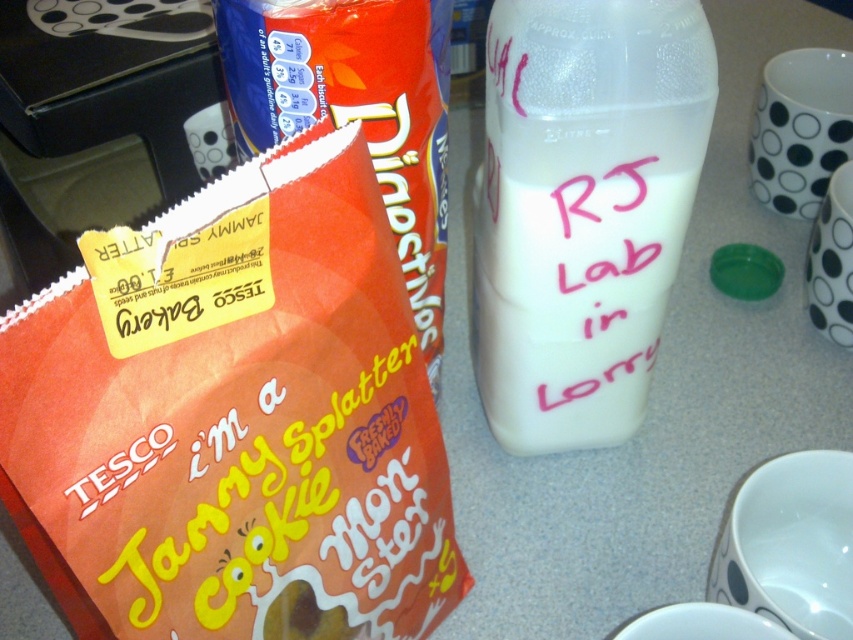
Who is shorter, orange paper bag at left or white marker text at center?

white marker text at center

Looking at this image, can you confirm if orange paper bag at left is positioned below white marker text at center?

Indeed, orange paper bag at left is positioned under white marker text at center.

Is point (218, 188) positioned after point (596, 305)?

No, it is not.

Find the location of `orange paper bag at left`. orange paper bag at left is located at coordinates (235, 420).

Does orange paper bag at left appear on the right side of white opaque milk at center?

In fact, orange paper bag at left is to the left of white opaque milk at center.

What do you see at coordinates (235, 420) in the screenshot?
I see `orange paper bag at left` at bounding box center [235, 420].

Describe the element at coordinates (235, 420) in the screenshot. I see `orange paper bag at left` at that location.

This screenshot has width=853, height=640. In order to click on orange paper bag at left in this screenshot , I will do `click(235, 420)`.

Is point (227, 97) in front of point (567, 195)?

That is False.

Between orange paper bag at center and white marker text at center, which one has more height?

orange paper bag at center

What do you see at coordinates (357, 109) in the screenshot? I see `orange paper bag at center` at bounding box center [357, 109].

At what (x,y) coordinates should I click in order to perform the action: click on orange paper bag at center. Please return your answer as a coordinate pair (x, y). Looking at the image, I should click on (357, 109).